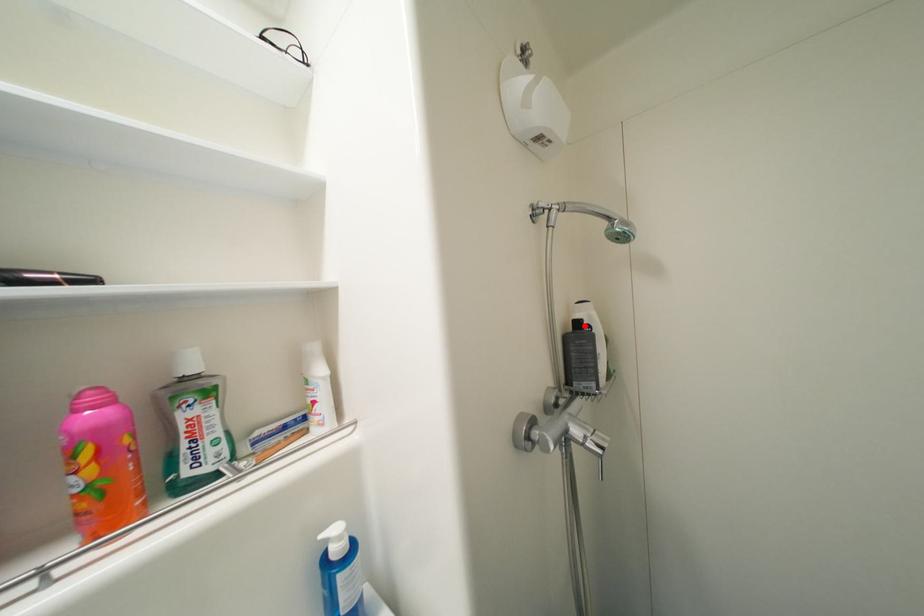
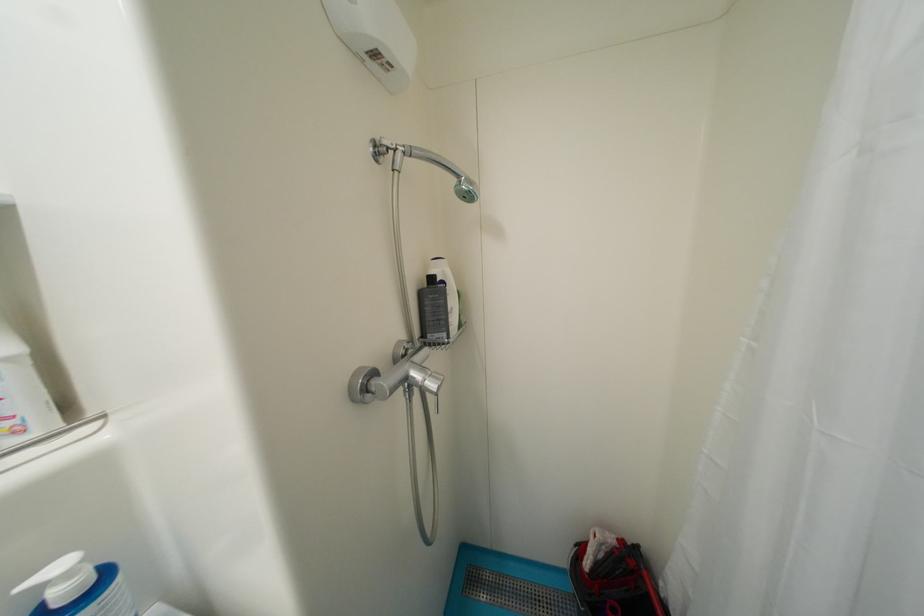
Where in the second image is the point corresponding to the highlighted location from the first image?

(439, 281)